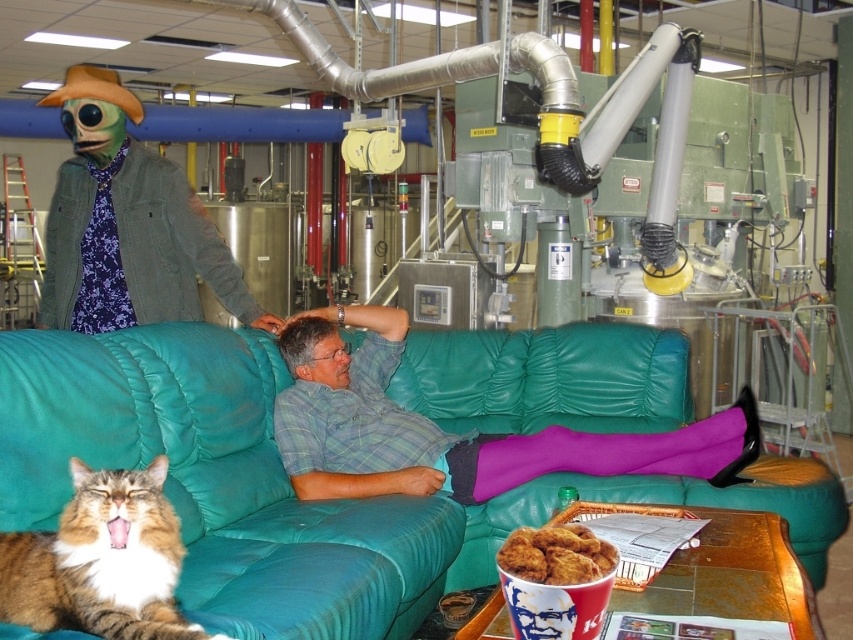
Find the location of a particular element. The image size is (853, 640). plaid shirt at center is located at coordinates (453, 435).

Is plaid shirt at center thinner than tabby fur cat at lower left?

No.

Identify the location of plaid shirt at center. The height and width of the screenshot is (640, 853). (453, 435).

Identify the location of teal leather couch at center. The width and height of the screenshot is (853, 640). (289, 484).

Which is in front, point (190, 401) or point (706, 470)?

Point (190, 401) is in front.

I want to click on teal leather couch at center, so click(289, 484).

Is plaid shirt at center smaller than golden crispy chicken at lower center?

No, plaid shirt at center is not smaller than golden crispy chicken at lower center.

Can you confirm if plaid shirt at center is shorter than golden crispy chicken at lower center?

No, plaid shirt at center is not shorter than golden crispy chicken at lower center.

What do you see at coordinates (453, 435) in the screenshot? The image size is (853, 640). I see `plaid shirt at center` at bounding box center [453, 435].

Find the location of a particular element. The height and width of the screenshot is (640, 853). plaid shirt at center is located at coordinates (453, 435).